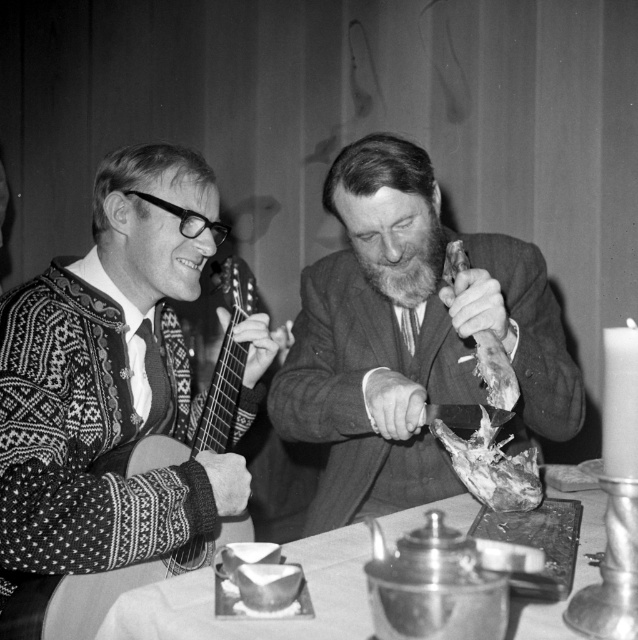
Question: Does raw meat at center appear on the right side of leathery brown skin at right?

Choices:
 (A) yes
 (B) no

Answer: (A)

Question: Which object is closer to the camera taking this photo?

Choices:
 (A) leathery brown skin at right
 (B) knitted sweater at left
 (C) raw meat at center

Answer: (B)

Question: Estimate the real-world distances between objects in this image. Which object is closer to the knitted sweater at left?

Choices:
 (A) dark brown leather jacket at center
 (B) raw meat at center
 (C) leathery brown skin at right

Answer: (A)

Question: Which object is positioned farthest from the leathery brown skin at right?

Choices:
 (A) metallic silver table at lower center
 (B) raw meat at center

Answer: (A)

Question: Is the position of knitted sweater at left less distant than that of dark brown leather jacket at center?

Choices:
 (A) no
 (B) yes

Answer: (B)

Question: Does metallic silver table at lower center have a greater width compared to raw meat at center?

Choices:
 (A) no
 (B) yes

Answer: (B)